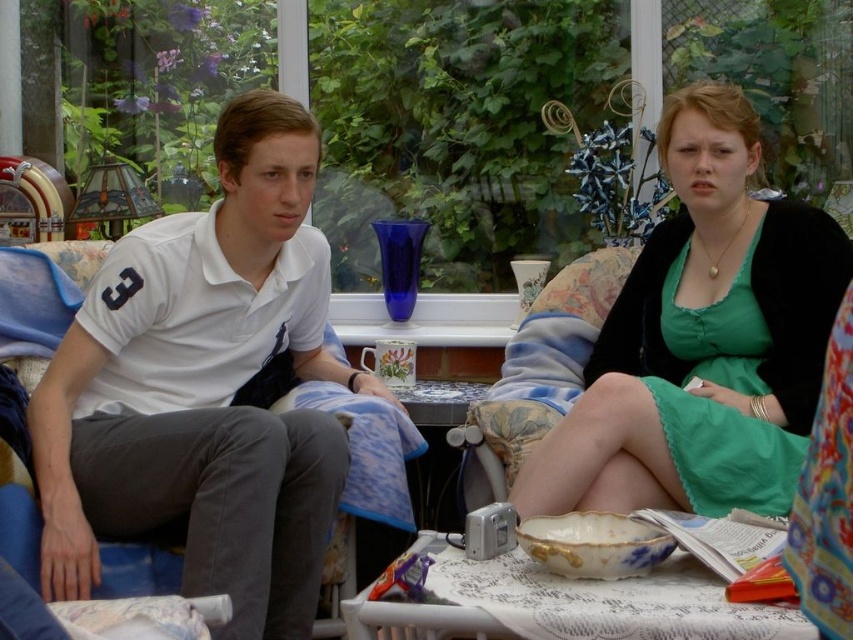
You are a photographer setting up a shoot in this sunroom. You need to position a light source to the right of both the white cotton polo shirt at left and the green satin dress at center. Is this possible given their positions?

The white cotton polo shirt at left is to the left of the green satin dress at center, so placing a light source to the right of both is possible as long as it is positioned to the right side of the green satin dress at center.

You are a fashion designer observing the scene. You need to decide which item has a greater width between the green satin dress at center and the porcelain bowl at lower center. Which one is wider?

The green satin dress at center is wider than the porcelain bowl at lower center according to the description.

Looking at this image, in the scene, there are a white cotton polo shirt at left and a porcelain bowl at lower center. Which object is located more to the left?

The white cotton polo shirt at left is positioned more to the left than the porcelain bowl at lower center.